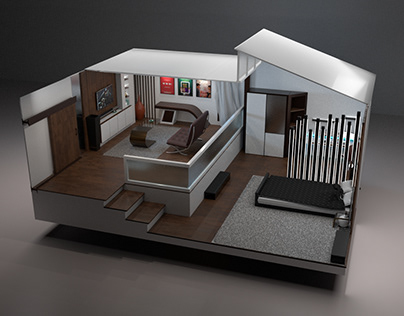
The height and width of the screenshot is (316, 404). Identify the location of curved coffee table in the room on the left. click(138, 130).